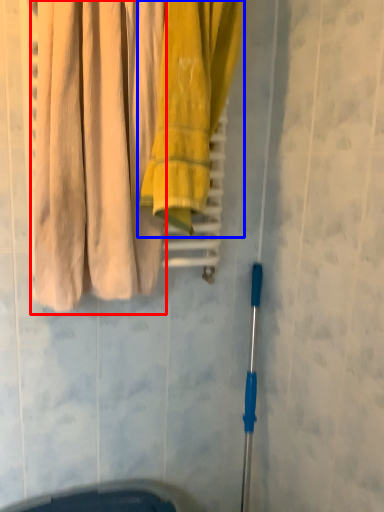
Question: Among these objects, which one is farthest to the camera, curtain (highlighted by a red box) or towel (highlighted by a blue box)?

Choices:
 (A) curtain
 (B) towel

Answer: (B)